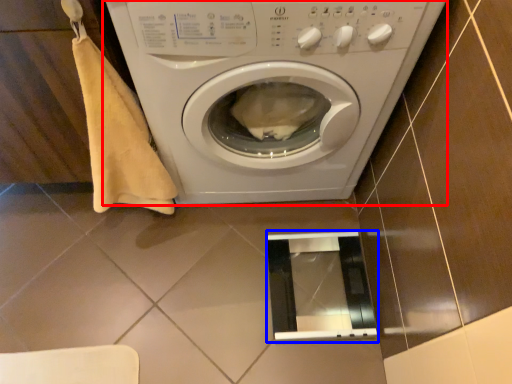
Question: Among these objects, which one is farthest to the camera, washing machine (highlighted by a red box) or screen door (highlighted by a blue box)?

Choices:
 (A) washing machine
 (B) screen door

Answer: (B)